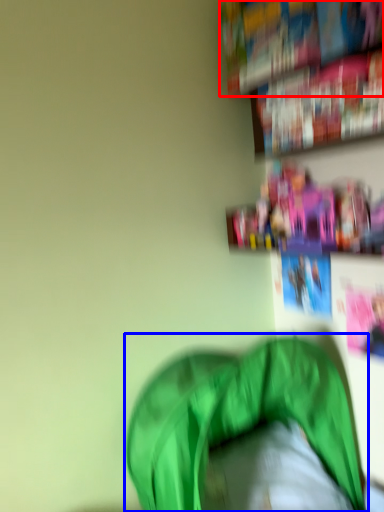
Question: Which of the following is the farthest to the observer, book (highlighted by a red box) or bean bag chair (highlighted by a blue box)?

Choices:
 (A) book
 (B) bean bag chair

Answer: (A)